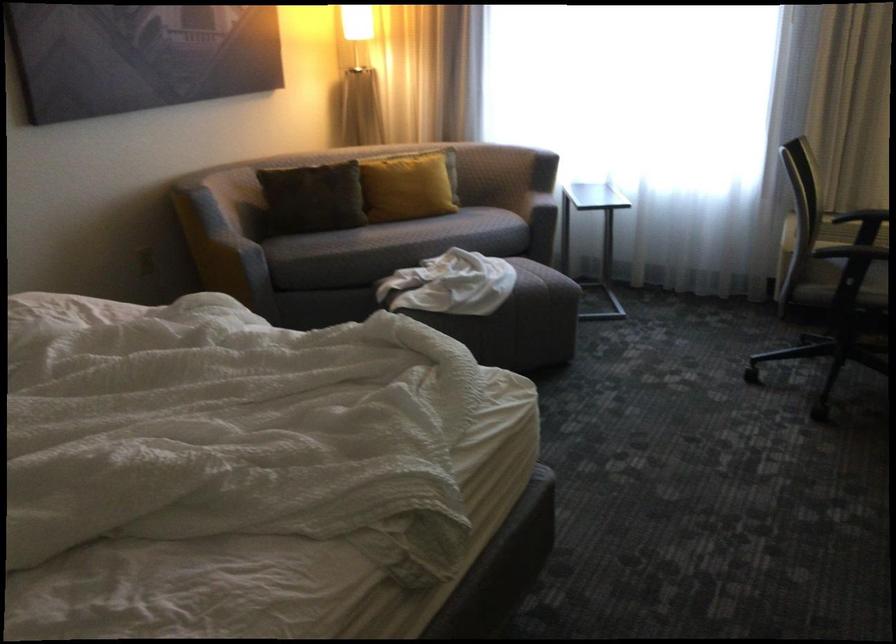
This screenshot has width=896, height=644. What do you see at coordinates (864, 216) in the screenshot? I see `the black chair armrest` at bounding box center [864, 216].